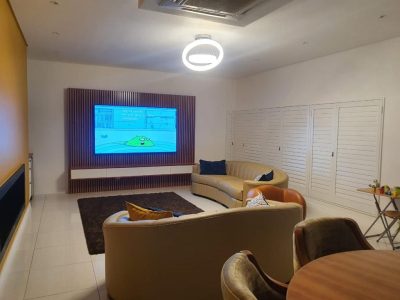
The image size is (400, 300). In order to click on pillow in this screenshot , I will do tap(145, 205).